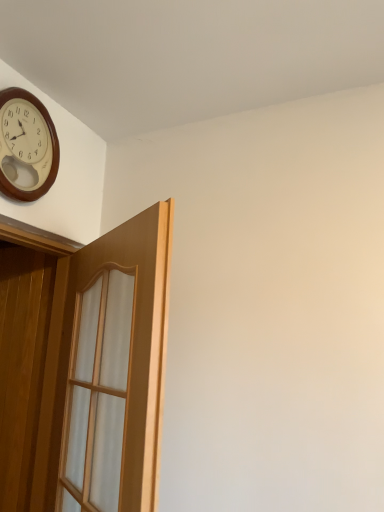
Question: From their relative heights in the image, would you say wooden clock at upper left is taller or shorter than light brown wood door at upper left?

Choices:
 (A) short
 (B) tall

Answer: (A)

Question: From a real-world perspective, is wooden clock at upper left physically located above or below light brown wood door at upper left?

Choices:
 (A) above
 (B) below

Answer: (A)

Question: From the image's perspective, is wooden clock at upper left located above or below light brown wood door at upper left?

Choices:
 (A) above
 (B) below

Answer: (A)

Question: Would you say light brown wood door at upper left is to the left or to the right of wooden clock at upper left in the picture?

Choices:
 (A) left
 (B) right

Answer: (B)

Question: Choose the correct answer: Is light brown wood door at upper left inside wooden clock at upper left or outside it?

Choices:
 (A) inside
 (B) outside

Answer: (B)

Question: From a real-world perspective, is light brown wood door at upper left physically located above or below wooden clock at upper left?

Choices:
 (A) above
 (B) below

Answer: (B)

Question: From the image's perspective, is light brown wood door at upper left positioned above or below wooden clock at upper left?

Choices:
 (A) above
 (B) below

Answer: (B)